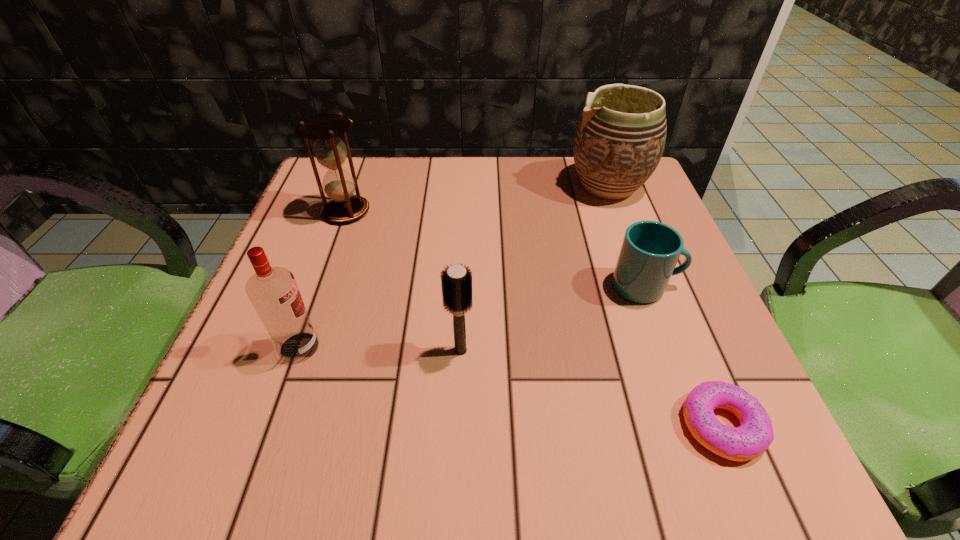
This screenshot has width=960, height=540. I want to click on pottery, so (x=619, y=140).

Identify the location of hourglass. (330, 151).

The height and width of the screenshot is (540, 960). In order to click on vodka in this screenshot , I will do `click(273, 292)`.

Find the location of a particular element. The width and height of the screenshot is (960, 540). the fourth object from right to left is located at coordinates (456, 282).

Identify the location of hairbrush. This screenshot has height=540, width=960. (456, 282).

In order to click on the fourth nearest object in this screenshot , I will do `click(650, 250)`.

Identify the location of cup. The height and width of the screenshot is (540, 960). (650, 250).

This screenshot has height=540, width=960. Identify the location of doughnut. (752, 438).

Where is `the shortest object`? This screenshot has width=960, height=540. the shortest object is located at coordinates [x=752, y=438].

The height and width of the screenshot is (540, 960). Find the location of `free point located 0.240m on the front of the pottery`. free point located 0.240m on the front of the pottery is located at coordinates (647, 290).